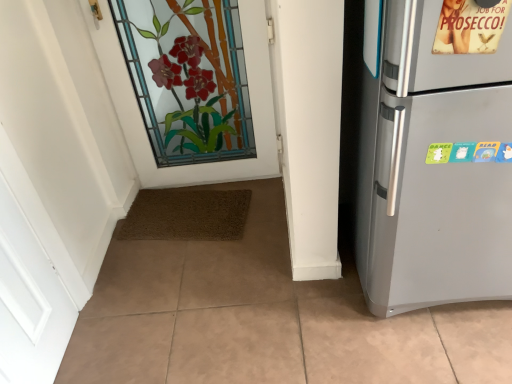
The image size is (512, 384). In order to click on satin silver refrigerator at right in this screenshot , I will do `click(434, 157)`.

The height and width of the screenshot is (384, 512). What do you see at coordinates (434, 157) in the screenshot?
I see `satin silver refrigerator at right` at bounding box center [434, 157].

At what (x,y) coordinates should I click in order to perform the action: click on stained glass door at upper center. Please return your answer as a coordinate pair (x, y). This screenshot has height=384, width=512. Looking at the image, I should click on (251, 111).

What do you see at coordinates (251, 111) in the screenshot?
I see `stained glass door at upper center` at bounding box center [251, 111].

In order to face stained glass door at upper center, should I rotate leftwards or rightwards?

A 3.120 degree turn to the left will do.

Image resolution: width=512 pixels, height=384 pixels. I want to click on satin silver refrigerator at right, so click(434, 157).

Between satin silver refrigerator at right and stained glass door at upper center, which one appears on the right side from the viewer's perspective?

Positioned to the right is satin silver refrigerator at right.

Is satin silver refrigerator at right in front of or behind stained glass door at upper center in the image?

satin silver refrigerator at right is in front of stained glass door at upper center.

Is point (447, 226) positioned before point (125, 111)?

Yes, point (447, 226) is closer to viewer.

From the image's perspective, relative to stained glass door at upper center, is satin silver refrigerator at right above or below?

satin silver refrigerator at right is situated lower than stained glass door at upper center in the image.

From a real-world perspective, between satin silver refrigerator at right and stained glass door at upper center, who is vertically lower?

From a 3D spatial view, stained glass door at upper center is below.

Does satin silver refrigerator at right have a lesser width compared to stained glass door at upper center?

No, satin silver refrigerator at right is not thinner than stained glass door at upper center.

Which of these two, satin silver refrigerator at right or stained glass door at upper center, stands taller?

With more height is satin silver refrigerator at right.

Based on their sizes in the image, would you say satin silver refrigerator at right is bigger or smaller than stained glass door at upper center?

In the image, satin silver refrigerator at right appears to be larger than stained glass door at upper center.

Which is correct: satin silver refrigerator at right is inside stained glass door at upper center, or outside of it?

satin silver refrigerator at right is spatially situated outside stained glass door at upper center.

Can you see satin silver refrigerator at right touching stained glass door at upper center?

No, satin silver refrigerator at right is not touching stained glass door at upper center.

Is stained glass door at upper center at the back of satin silver refrigerator at right?

No, satin silver refrigerator at right is not facing the opposite direction of stained glass door at upper center.

What's the angular difference between satin silver refrigerator at right and stained glass door at upper center's facing directions?

The angle between the facing direction of satin silver refrigerator at right and the facing direction of stained glass door at upper center is 3.05 degrees.

At what (x,y) coordinates should I click in order to perform the action: click on refrigerator lying on the right of stained glass door at upper center. Please return your answer as a coordinate pair (x, y). The image size is (512, 384). Looking at the image, I should click on (x=434, y=157).

Does stained glass door at upper center appear on the right side of satin silver refrigerator at right?

No, stained glass door at upper center is not to the right of satin silver refrigerator at right.

In the scene shown: In the image, is stained glass door at upper center positioned in front of or behind satin silver refrigerator at right?

stained glass door at upper center is behind satin silver refrigerator at right.

Is point (250, 71) positioned before point (374, 287)?

No, (250, 71) is behind (374, 287).

From the image's perspective, is stained glass door at upper center positioned above or below satin silver refrigerator at right?

stained glass door at upper center is above satin silver refrigerator at right.

From a real-world perspective, is stained glass door at upper center on top of satin silver refrigerator at right?

No, from a real-world perspective, stained glass door at upper center is not above satin silver refrigerator at right.

Considering the sizes of objects stained glass door at upper center and satin silver refrigerator at right in the image provided, who is wider, stained glass door at upper center or satin silver refrigerator at right?

Wider between the two is satin silver refrigerator at right.

Which of these two, stained glass door at upper center or satin silver refrigerator at right, stands taller?

With more height is satin silver refrigerator at right.

Based on their sizes in the image, would you say stained glass door at upper center is bigger or smaller than satin silver refrigerator at right?

Clearly, stained glass door at upper center is smaller in size than satin silver refrigerator at right.

Is stained glass door at upper center positioned beyond the bounds of satin silver refrigerator at right?

stained glass door at upper center is positioned outside satin silver refrigerator at right.

Would you say stained glass door at upper center is a long distance from satin silver refrigerator at right?

That's right, there is a large distance between stained glass door at upper center and satin silver refrigerator at right.

Does stained glass door at upper center turn towards satin silver refrigerator at right?

No, stained glass door at upper center is not turned towards satin silver refrigerator at right.

Image resolution: width=512 pixels, height=384 pixels. I want to click on door on the left of satin silver refrigerator at right, so point(251,111).

The width and height of the screenshot is (512, 384). In order to click on door above the satin silver refrigerator at right (from the image's perspective) in this screenshot , I will do `click(251, 111)`.

You are a GUI agent. You are given a task and a screenshot of the screen. Output one action in this format:
    pyautogui.click(x=<x>, y=<y>)
    Task: Click on the door behind the satin silver refrigerator at right
    
    Given the screenshot: What is the action you would take?
    pyautogui.click(x=251, y=111)